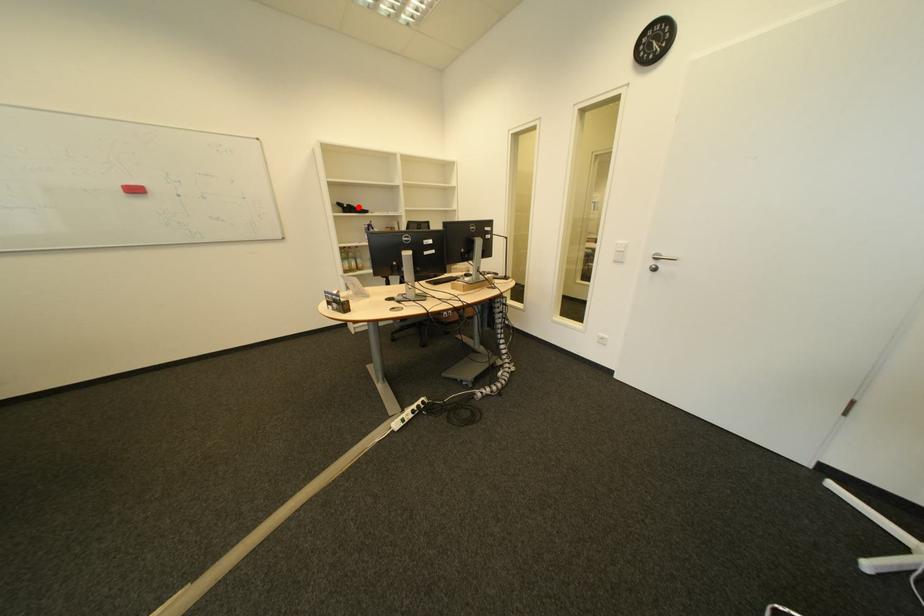
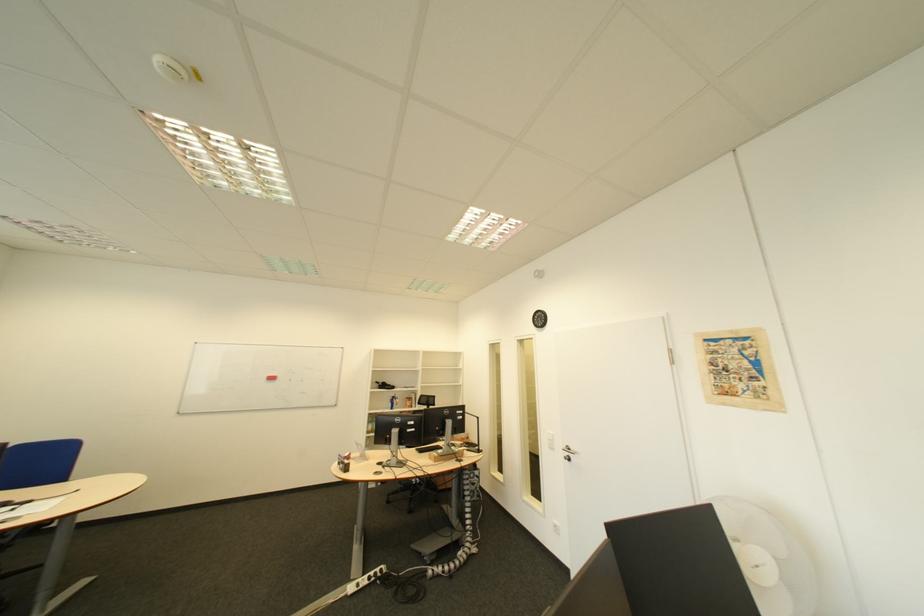
The point at the highlighted location is marked in the first image. Where is the corresponding point in the second image?

(393, 385)